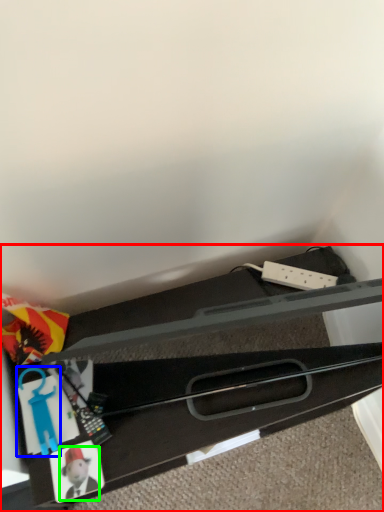
Question: Based on their relative distances, which object is farther from furniture (highlighted by a red box)? Choose from toy (highlighted by a blue box) and toy (highlighted by a green box).

Choices:
 (A) toy
 (B) toy

Answer: (B)